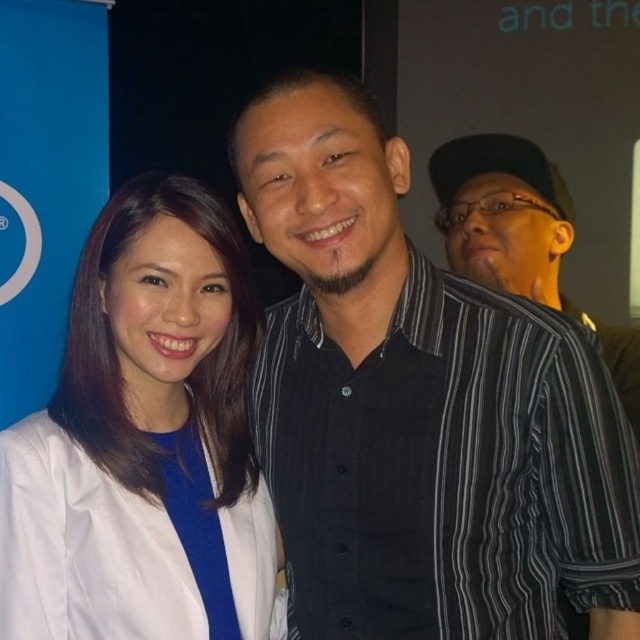
You are a photographer setting up for a group photo. You notice the white matte coat at left and the black striped shirt at right in the frame. Which clothing item is shorter in height?

The white matte coat at left is shorter than the black striped shirt at right.

You are organizing a photo shoot and want to ensure that both the black striped shirt at center and the black striped shirt at right are clearly visible in the final image. Given their sizes in the photo, which one might need to be moved closer to the camera to appear larger?

The black striped shirt at center occupies less space than the black striped shirt at right, so the black striped shirt at center should be moved closer to the camera to appear larger.

You are a photographer setting up for a group photo. You notice the white matte coat at left and the black striped shirt at right in the frame. Based on their positions, which object should you adjust to ensure both are fully visible in the photo?

The white matte coat at left is located below the black striped shirt at right. To ensure both are fully visible, adjust the white matte coat at left to move it upwards so it doesn